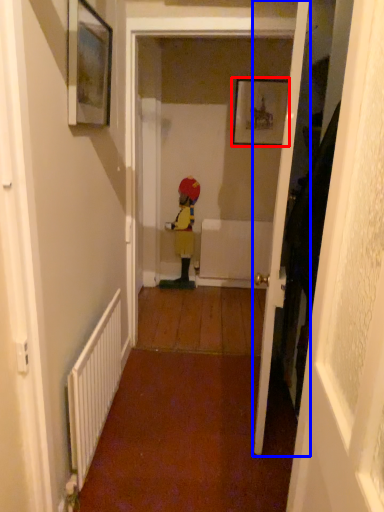
Question: Which object is closer to the camera taking this photo, picture frame (highlighted by a red box) or door (highlighted by a blue box)?

Choices:
 (A) picture frame
 (B) door

Answer: (B)